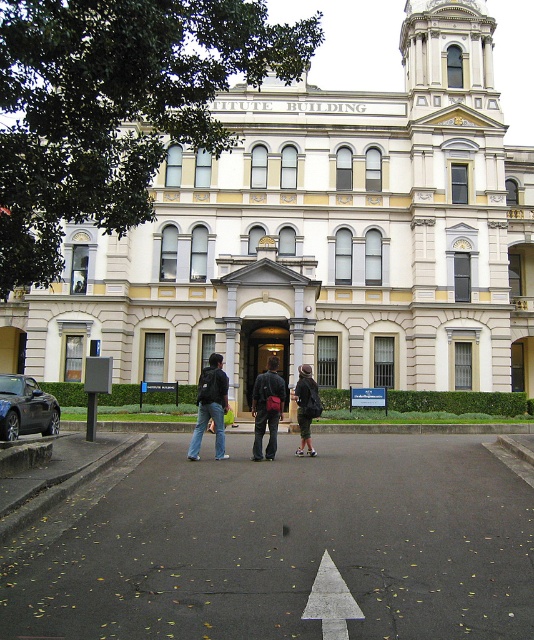
Does point (11, 392) lie behind point (263, 392)?

That is True.

The image size is (534, 640). Describe the element at coordinates (26, 406) in the screenshot. I see `shiny black car at left` at that location.

The height and width of the screenshot is (640, 534). Identify the location of shiny black car at left. (26, 406).

I want to click on shiny black car at left, so click(x=26, y=406).

Is point (263, 598) less distant than point (197, 420)?

That is True.

Looking at this image, does black asphalt pavement at center have a smaller size compared to jeans at center?

Yes, black asphalt pavement at center is smaller than jeans at center.

Is point (32, 621) closer to viewer compared to point (200, 422)?

Yes, point (32, 621) is in front of point (200, 422).

You are a GUI agent. You are given a task and a screenshot of the screen. Output one action in this format:
    pyautogui.click(x=<x>, y=<y>)
    Task: Click on the black asphalt pavement at center
    
    Given the screenshot: What is the action you would take?
    pyautogui.click(x=290, y=547)

Is black asphalt pavement at center shorter than dark blue jeans at center?

Yes, black asphalt pavement at center is shorter than dark blue jeans at center.

At what (x,y) coordinates should I click in order to perform the action: click on black asphalt pavement at center. Please return your answer as a coordinate pair (x, y). The width and height of the screenshot is (534, 640). Looking at the image, I should click on (290, 547).

You are a GUI agent. You are given a task and a screenshot of the screen. Output one action in this format:
    pyautogui.click(x=<x>, y=<y>)
    Task: Click on the black asphalt pavement at center
    The image size is (534, 640).
    Given the screenshot: What is the action you would take?
    pyautogui.click(x=290, y=547)